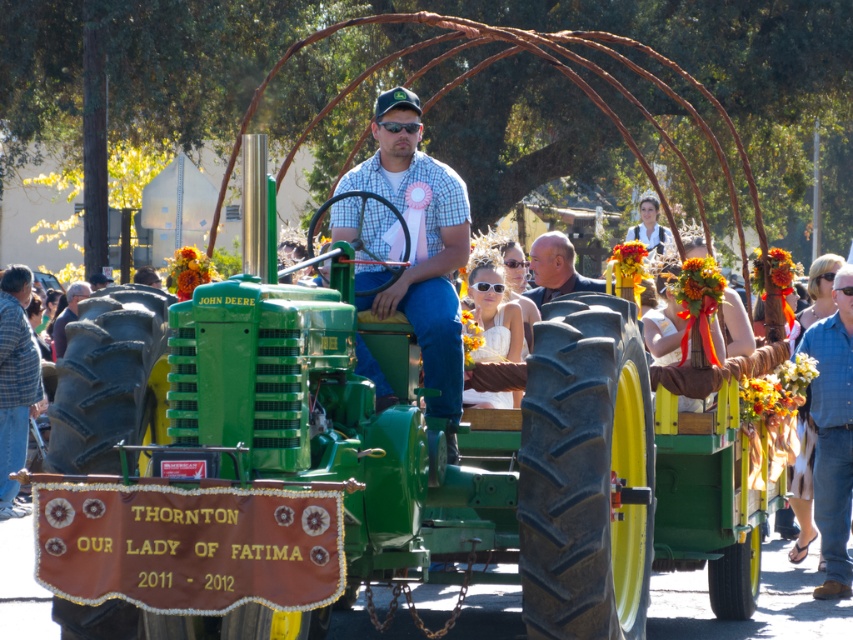
Question: Which is farther from the smooth brown leather jacket at center?

Choices:
 (A) denim jeans at lower right
 (B) blue plaid shirt at left

Answer: (B)

Question: Does smooth brown leather jacket at center have a larger size compared to dark brown leather jacket at lower left?

Choices:
 (A) yes
 (B) no

Answer: (A)

Question: Which point is farther to the camera?

Choices:
 (A) smooth brown leather jacket at center
 (B) blue plaid shirt at left
 (C) denim jeans at lower right

Answer: (B)

Question: Is blue plaid shirt at left to the right of smooth brown leather jacket at center from the viewer's perspective?

Choices:
 (A) no
 (B) yes

Answer: (A)

Question: Which object is the farthest from the dark brown leather jacket at lower left?

Choices:
 (A) smooth brown leather jacket at center
 (B) blue plaid shirt at left

Answer: (A)

Question: Is the position of denim jeans at lower right more distant than that of blue plaid shirt at left?

Choices:
 (A) no
 (B) yes

Answer: (A)